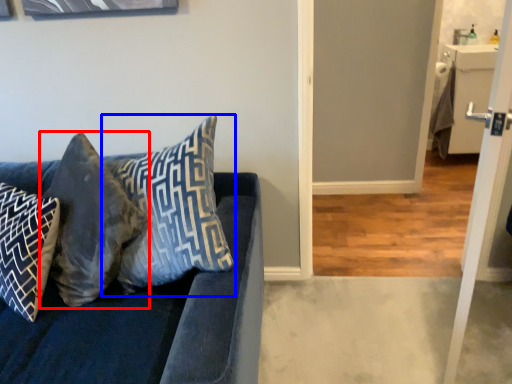
Question: Among these objects, which one is farthest to the camera, pillow (highlighted by a red box) or pillow (highlighted by a blue box)?

Choices:
 (A) pillow
 (B) pillow

Answer: (A)